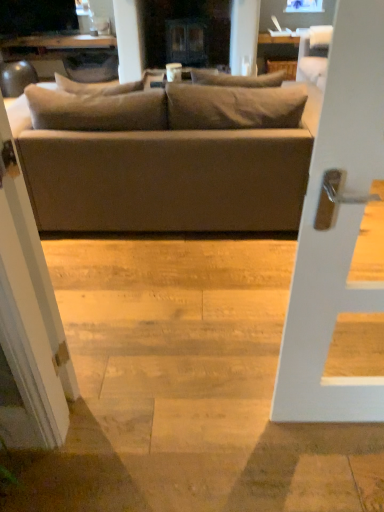
Image resolution: width=384 pixels, height=512 pixels. Identify the location of vacant space behind white glossy screen door at left. (89, 359).